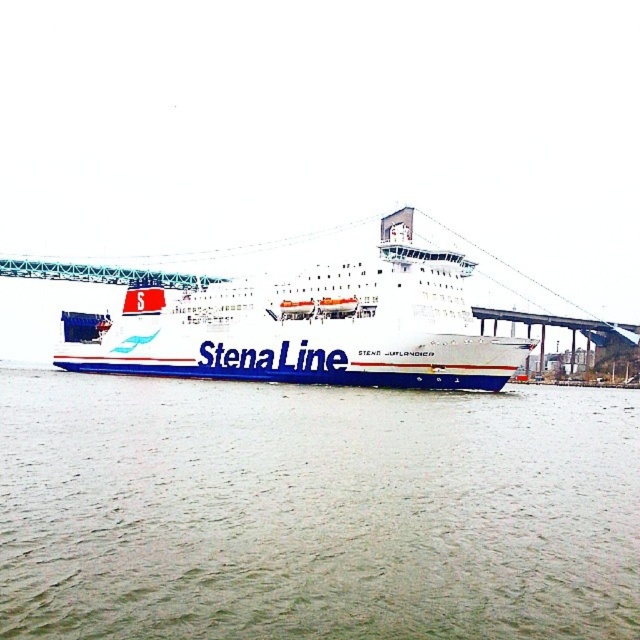
Based on the photo, you are a passenger on the white matte ship at center. You want to see the green water at center. In which direction should you look?

The green water at center is below the white matte ship at center, so you should look downward to see the green water at center.

You are standing on the dock and looking at the green water at center and the white matte ship at center. Which object is nearer to you?

The green water at center is closer to the viewer than the white matte ship at center.